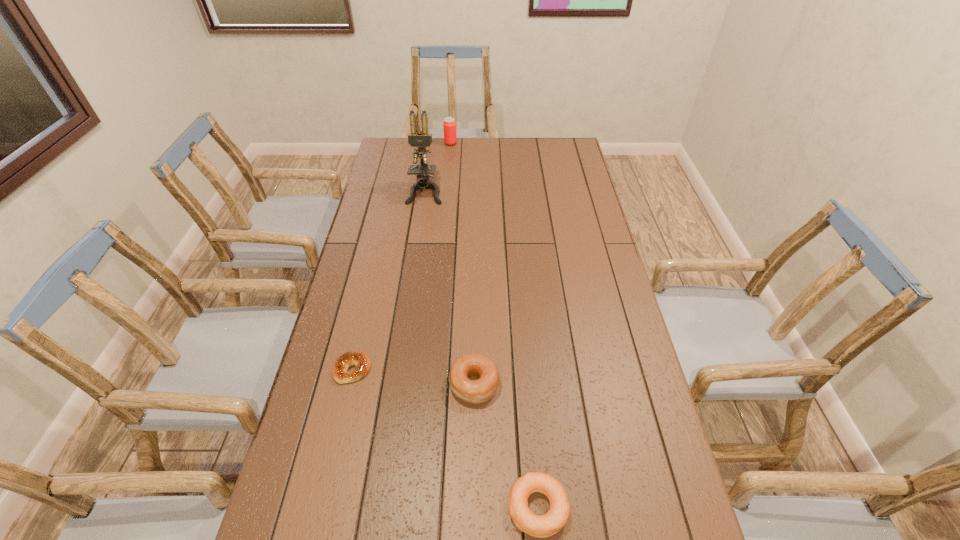
Find the location of `vacant space situated 0.330m on the right of the tallest bagel`. vacant space situated 0.330m on the right of the tallest bagel is located at coordinates (622, 384).

This screenshot has height=540, width=960. Identify the location of vacant region located on the back of the shortest bagel. (369, 299).

Find the location of a particular element. object at the far edge is located at coordinates (449, 125).

Where is `microscope that is positioned at the left edge`? The image size is (960, 540). microscope that is positioned at the left edge is located at coordinates (421, 139).

Identify the location of bagel that is at the left edge. Image resolution: width=960 pixels, height=540 pixels. (360, 359).

In the image, there is a desktop. At what (x,y) coordinates should I click in order to perform the action: click on vacant space at the far edge. Please return your answer as a coordinate pair (x, y). Looking at the image, I should click on (513, 148).

Where is `vacant position at the left edge of the desktop`? The image size is (960, 540). vacant position at the left edge of the desktop is located at coordinates (289, 507).

Find the location of a particular element. This screenshot has height=540, width=960. vacant space at the right edge of the desktop is located at coordinates (558, 197).

The height and width of the screenshot is (540, 960). I want to click on vacant space at the far left corner of the desktop, so click(396, 146).

Locate an element on the screen. This screenshot has width=960, height=540. free space at the far right corner of the desktop is located at coordinates (567, 148).